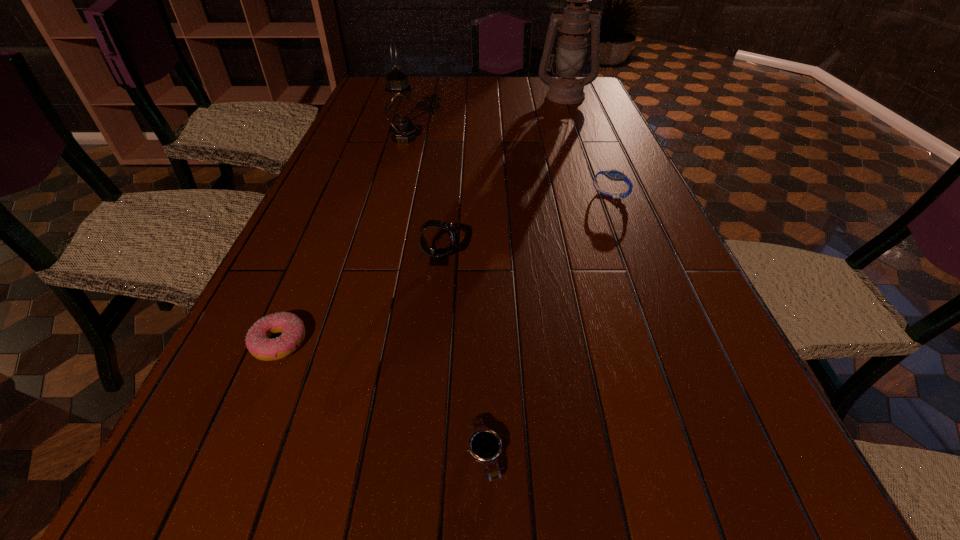
The width and height of the screenshot is (960, 540). I want to click on the shortest object, so click(485, 445).

In order to click on the nearest watch in this screenshot , I will do `click(485, 445)`.

Where is `free space located 0.260m on the left of the right oil lamp`? free space located 0.260m on the left of the right oil lamp is located at coordinates (468, 96).

Locate an element on the screen. Image resolution: width=960 pixels, height=540 pixels. vacant space located on the right of the left oil lamp is located at coordinates (540, 138).

Where is `vacant space located 0.200m on the face of the leftmost watch`? The width and height of the screenshot is (960, 540). vacant space located 0.200m on the face of the leftmost watch is located at coordinates (548, 260).

Where is `free space located on the left of the fourth tallest object`? The height and width of the screenshot is (540, 960). free space located on the left of the fourth tallest object is located at coordinates (563, 195).

Identify the location of vacant position located on the back of the fifth farthest object. The image size is (960, 540). (333, 213).

Where is `vacant point located 0.190m on the right of the shortest watch`? This screenshot has width=960, height=540. vacant point located 0.190m on the right of the shortest watch is located at coordinates (629, 455).

This screenshot has width=960, height=540. What are the coordinates of `object at the far edge` in the screenshot? It's located at (574, 23).

I want to click on oil lamp that is at the left edge, so click(400, 112).